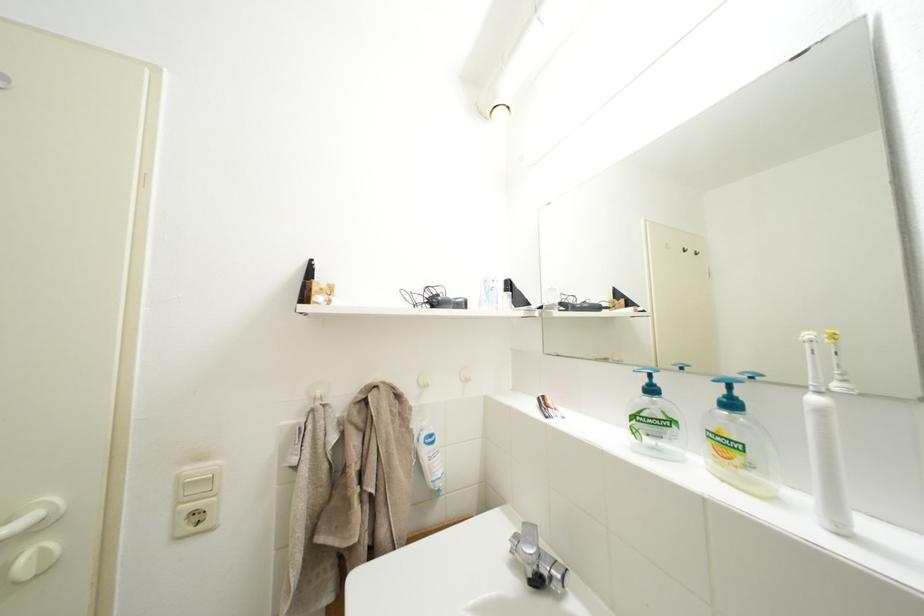
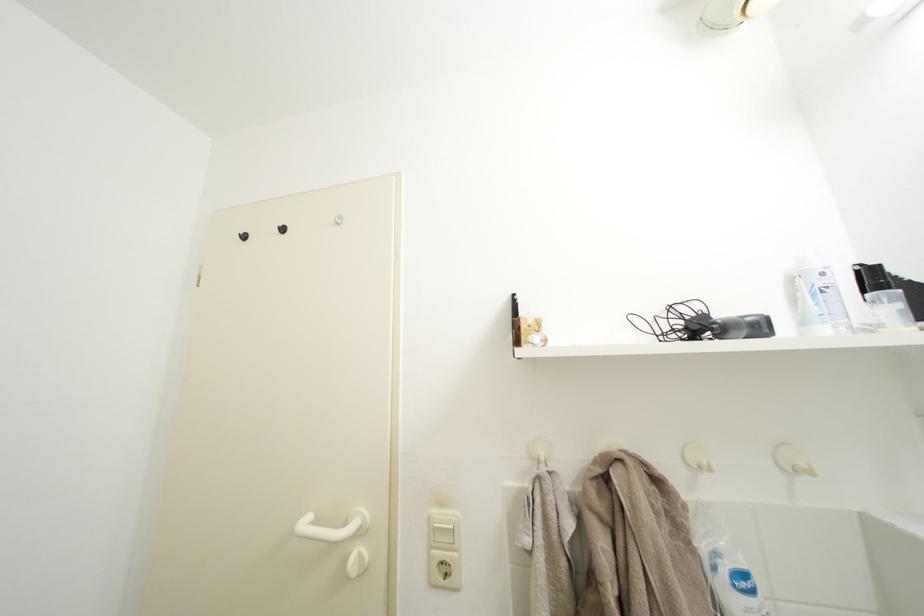
Find the pixel in the second image that matches [503,286] in the first image.

(833, 280)